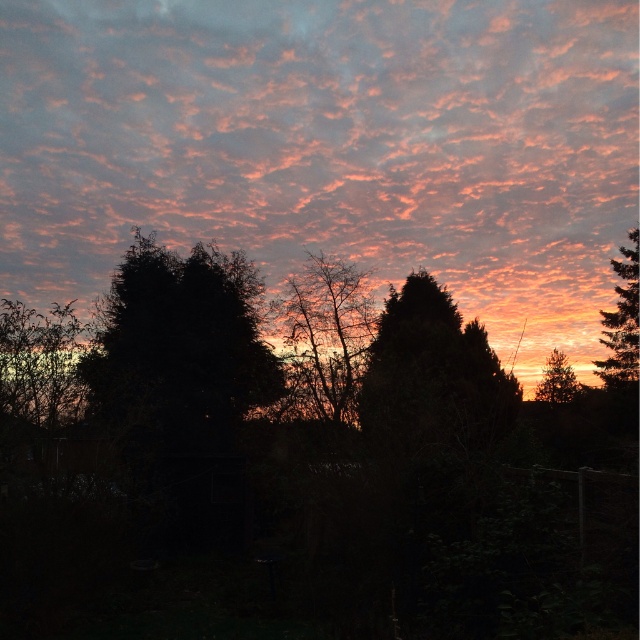
Is matte pink cloud at upper center closer to camera compared to bare branches at center?

No, matte pink cloud at upper center is further to the viewer.

Locate an element on the screen. This screenshot has width=640, height=640. matte pink cloud at upper center is located at coordinates (330, 147).

What do you see at coordinates (330, 147) in the screenshot? I see `matte pink cloud at upper center` at bounding box center [330, 147].

The height and width of the screenshot is (640, 640). What are the coordinates of `matte pink cloud at upper center` in the screenshot? It's located at (330, 147).

Between dark green textured tree at center and green textured tree at right, which one has more height?

Standing taller between the two is dark green textured tree at center.

Is the position of dark green textured tree at center more distant than that of green textured tree at right?

No.

Is point (428, 321) more distant than point (600, 372)?

No, (428, 321) is closer to viewer.

Find the location of `dark green textured tree at center`. dark green textured tree at center is located at coordinates (433, 376).

Is dark green textured tree at center bigger than silvery textured pine tree at right?

Yes, dark green textured tree at center is bigger than silvery textured pine tree at right.

Which is below, dark green textured tree at center or silvery textured pine tree at right?

silvery textured pine tree at right

Between point (387, 406) and point (552, 378), which one is positioned in front?

Point (387, 406) is in front.

The height and width of the screenshot is (640, 640). In order to click on dark green textured tree at center in this screenshot , I will do `click(433, 376)`.